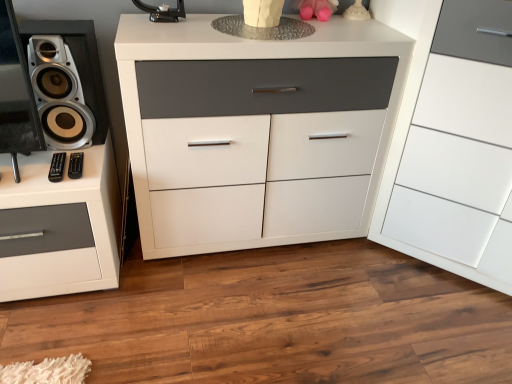
Question: From their relative heights in the image, would you say black plastic remote at lower left is taller or shorter than pink rubber toy at upper center?

Choices:
 (A) short
 (B) tall

Answer: (A)

Question: Based on their sizes in the image, would you say black plastic remote at lower left is bigger or smaller than pink rubber toy at upper center?

Choices:
 (A) big
 (B) small

Answer: (B)

Question: Estimate the real-world distances between objects in this image. Which object is closer to the white matte chest of drawers at center, which is the first chest of drawers from left to right?

Choices:
 (A) white glossy speaker at left
 (B) pink rubber toy at upper center
 (C) black plastic remote at lower left
 (D) white glossy drawer at center, the first chest of drawers when ordered from right to left

Answer: (D)

Question: Which object is the farthest from the black plastic remote at lower left?

Choices:
 (A) white glossy drawer at center, the first chest of drawers when ordered from right to left
 (B) white glossy speaker at left
 (C) pink rubber toy at upper center
 (D) white matte chest of drawers at center, which is the first chest of drawers from left to right

Answer: (A)